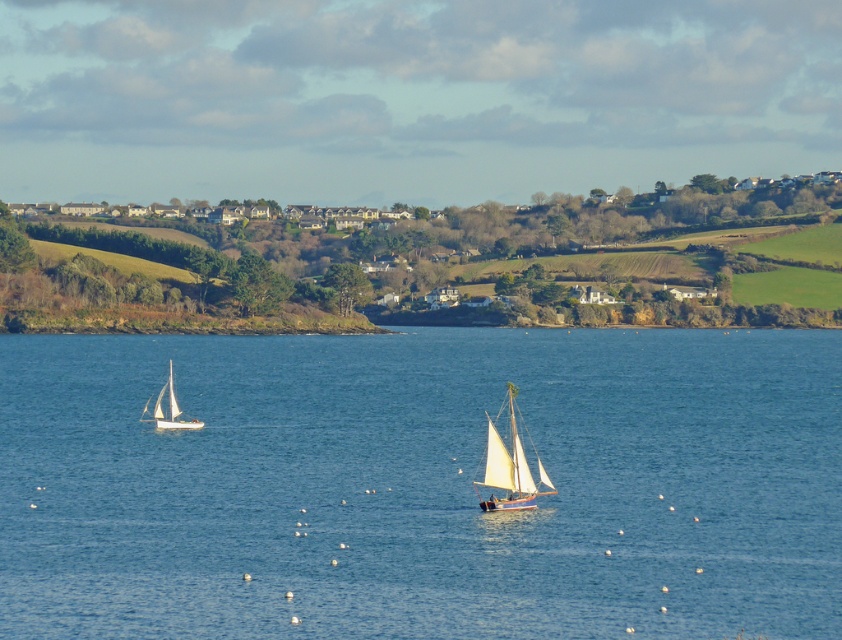
Consider the image. You are a sailor trying to navigate between the blue water at center and the white matte sailboat at lower left. Based on the scene, which one is wider?

The blue water at center might be wider than white matte sailboat at lower left according to the description.

You are a photographer standing on the shore and want to capture a photo of the blue water at center and the white matte sailboat at lower left. Based on their positions, which object will appear larger in the photo?

The blue water at center will appear larger in the photo because it is closer to the photographer than the white matte sailboat at lower left.

You are standing at the origin point of the image coordinate system, which is the bottom left corner. You see the point marked at coordinates point (421, 484). Which object is located at that point?

The blue water at center is located at point (421, 484).